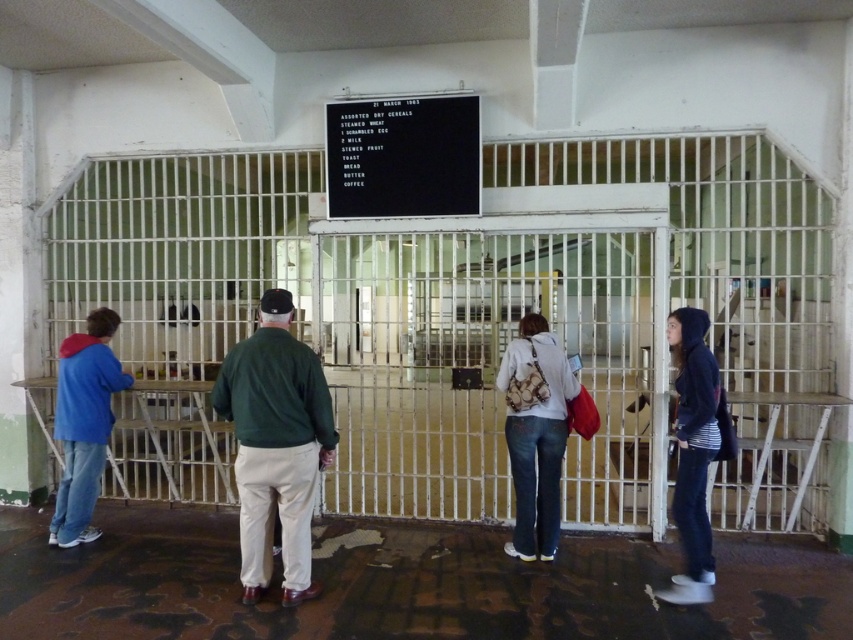
Question: Can you confirm if white cotton hoodie at center is thinner than blue fleece jacket at left?

Choices:
 (A) no
 (B) yes

Answer: (B)

Question: Which object is the farthest from the black matte signboard at center?

Choices:
 (A) white cotton hoodie at center
 (B) green sweater at center
 (C) blue fleece jacket at left
 (D) dark blue hoodie at right

Answer: (C)

Question: Which object appears closest to the camera in this image?

Choices:
 (A) dark blue hoodie at right
 (B) white cotton hoodie at center

Answer: (A)

Question: Which of these objects is positioned closest to the dark blue hoodie at right?

Choices:
 (A) blue fleece jacket at left
 (B) black matte signboard at center

Answer: (B)

Question: In this image, where is black matte signboard at center located relative to dark blue hoodie at right?

Choices:
 (A) above
 (B) below

Answer: (A)

Question: Does blue fleece jacket at left appear on the left side of dark blue hoodie at right?

Choices:
 (A) no
 (B) yes

Answer: (B)